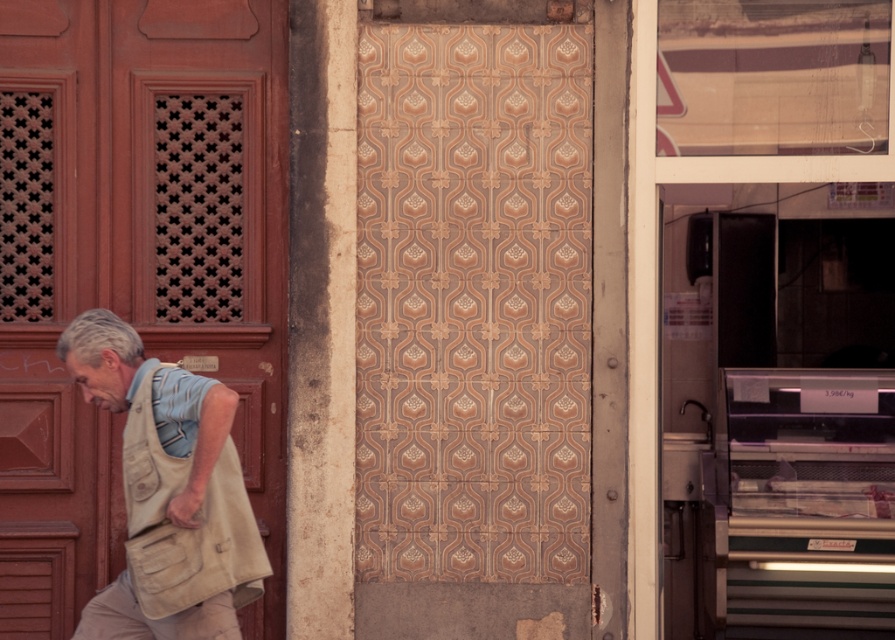
You are standing in front of the street scene and want to know which of the two points, point [13,561] or point [223,483], is closer to you. Can you determine this based on their positions?

Point [13,561] is further to the camera than point [223,483], so the closer point to you is point [223,483].